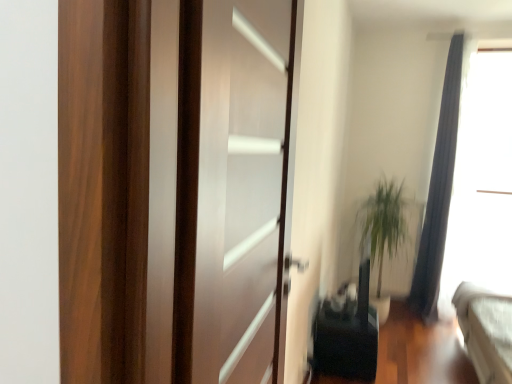
Question: From the image's perspective, is green leafy plant at right above or below transparent glass window screen at upper right?

Choices:
 (A) below
 (B) above

Answer: (A)

Question: From a real-world perspective, is green leafy plant at right physically located above or below transparent glass window screen at upper right?

Choices:
 (A) below
 (B) above

Answer: (A)

Question: Based on their relative distances, which object is farther from the black matte speaker at lower center?

Choices:
 (A) green leafy plant at right
 (B) silky gray curtain at right
 (C) transparent glass window screen at upper right
 (D) transparent glass door at center

Answer: (D)

Question: Which of these objects is positioned farthest from the silky gray curtain at right?

Choices:
 (A) green leafy plant at right
 (B) black matte speaker at lower center
 (C) transparent glass door at center
 (D) transparent glass window screen at upper right

Answer: (C)